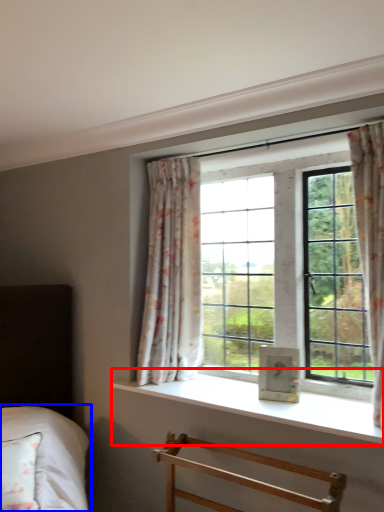
Question: Which point is further to the camera, window sill (highlighted by a red box) or bed (highlighted by a blue box)?

Choices:
 (A) window sill
 (B) bed

Answer: (B)